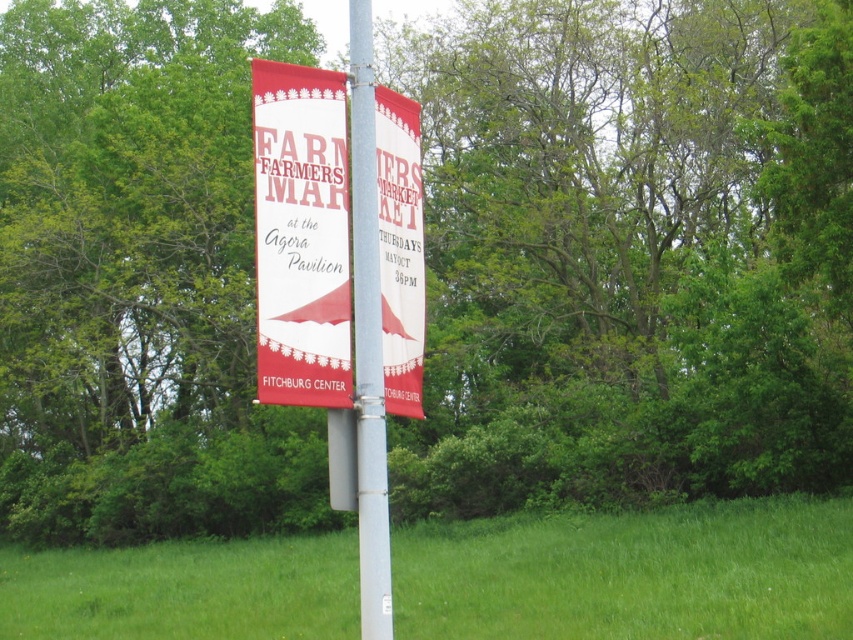
Does point (769, 548) lie behind point (318, 332)?

That is True.

Does green grass at center have a smaller size compared to matte white banner at center?

Actually, green grass at center might be larger than matte white banner at center.

Image resolution: width=853 pixels, height=640 pixels. Identify the location of green grass at center. (631, 573).

Locate an element on the screen. green grass at center is located at coordinates (631, 573).

In the scene shown: Does matte white banner at center appear on the right side of metallic silver pole at center?

Incorrect, matte white banner at center is not on the right side of metallic silver pole at center.

Based on the photo, who is positioned more to the right, matte white banner at center or metallic silver pole at center?

From the viewer's perspective, metallic silver pole at center appears more on the right side.

What do you see at coordinates (300, 236) in the screenshot? I see `matte white banner at center` at bounding box center [300, 236].

The height and width of the screenshot is (640, 853). I want to click on matte white banner at center, so click(300, 236).

Can you confirm if green grass at center is smaller than metallic silver pole at center?

No, green grass at center is not smaller than metallic silver pole at center.

From the picture: Does green grass at center appear on the right side of metallic silver pole at center?

No, green grass at center is not to the right of metallic silver pole at center.

Where is `green grass at center`? This screenshot has width=853, height=640. green grass at center is located at coordinates (631, 573).